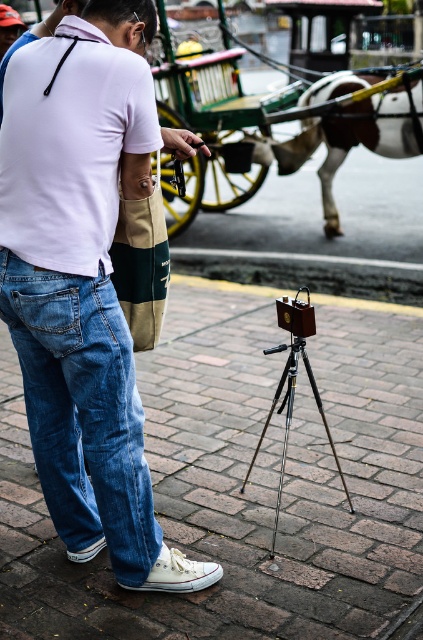
Question: Is blue denim jeans at lower left bigger than metallic tripod at center?

Choices:
 (A) yes
 (B) no

Answer: (A)

Question: Among these points, which one is farthest from the camera?

Choices:
 (A) (41, 307)
 (B) (415, 544)
 (C) (393, 157)

Answer: (C)

Question: Is denim jeans at lower left bigger than white glossy horse at upper center?

Choices:
 (A) yes
 (B) no

Answer: (B)

Question: Which of the following is the closest to the observer?

Choices:
 (A) brick pavement at center
 (B) denim jeans at lower left
 (C) white glossy horse at upper center

Answer: (B)

Question: Which of the following is the closest to the observer?

Choices:
 (A) metallic tripod at center
 (B) blue denim jeans at lower left
 (C) white glossy horse at upper center

Answer: (B)

Question: Is brick pavement at center closer to the viewer compared to denim jeans at lower left?

Choices:
 (A) no
 (B) yes

Answer: (A)